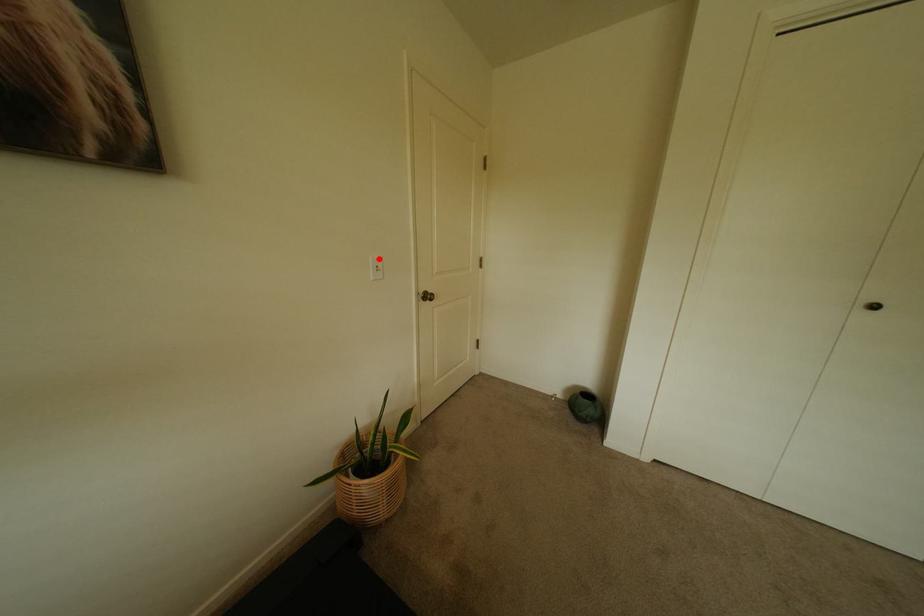
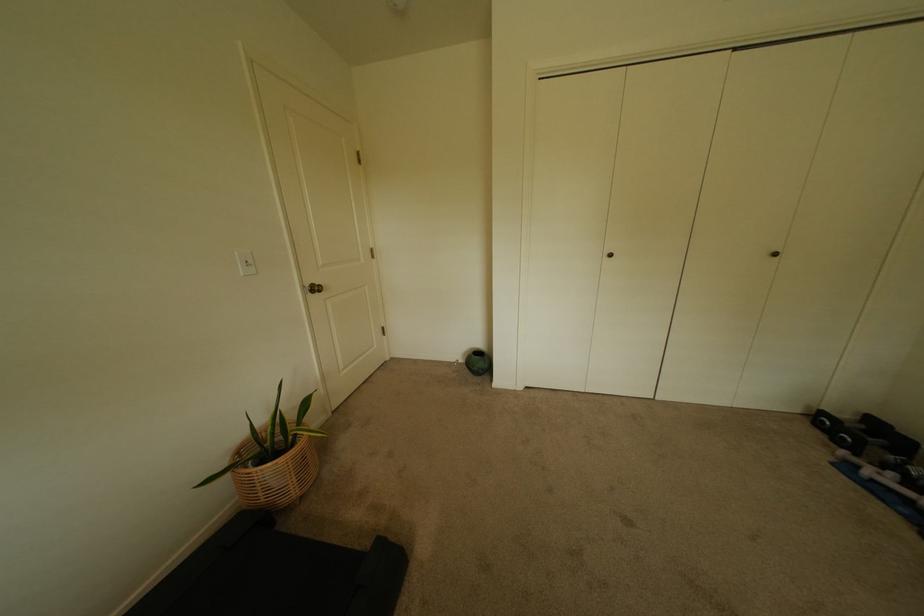
Question: I am providing you with two images of the same scene from different viewpoints. A red point is marked on the first image. At the location where the point appears in image 1, is it still visible in image 2?

Choices:
 (A) Yes
 (B) No

Answer: (A)